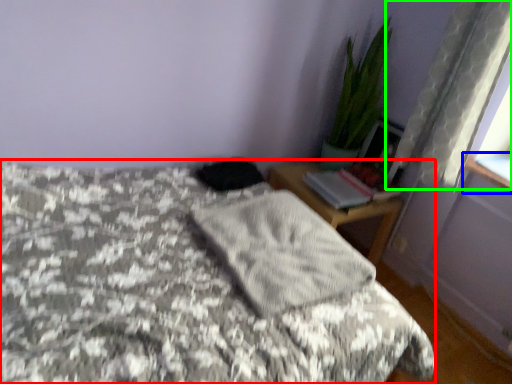
Question: Considering the real-world distances, which object is closest to bed (highlighted by a red box)? window sill (highlighted by a blue box) or curtain (highlighted by a green box).

Choices:
 (A) window sill
 (B) curtain

Answer: (B)